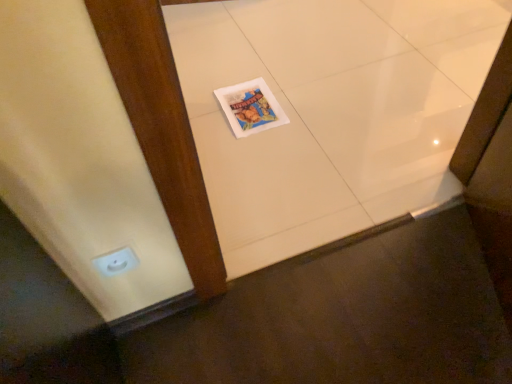
At what (x,y) coordinates should I click in order to perform the action: click on vacant space underneath matte paper magazine at center (from a real-world perspective). Please return your answer as a coordinate pair (x, y). This screenshot has width=512, height=384. Looking at the image, I should click on (251, 104).